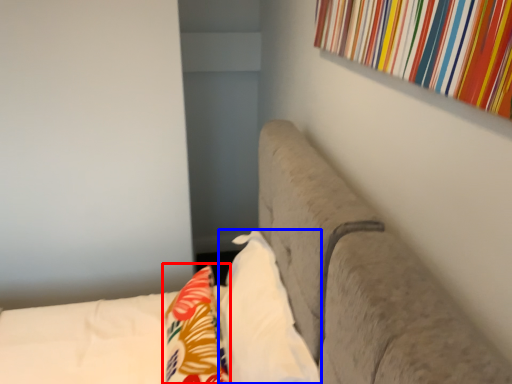
Question: Among these objects, which one is nearest to the camera, throw pillow (highlighted by a red box) or pillow (highlighted by a blue box)?

Choices:
 (A) throw pillow
 (B) pillow

Answer: (B)